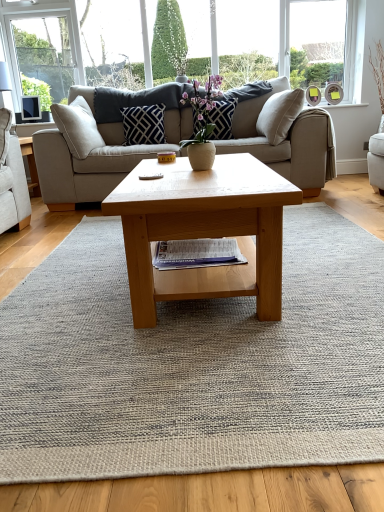
Question: From the image's perspective, is light brown wooden coffee table at center under neutral woven rug at center?

Choices:
 (A) no
 (B) yes

Answer: (A)

Question: Is neutral woven rug at center located within light brown wooden coffee table at center?

Choices:
 (A) yes
 (B) no

Answer: (B)

Question: Is light brown wooden coffee table at center completely or partially outside of neutral woven rug at center?

Choices:
 (A) no
 (B) yes

Answer: (B)

Question: Does light brown wooden coffee table at center have a greater height compared to neutral woven rug at center?

Choices:
 (A) yes
 (B) no

Answer: (A)

Question: From a real-world perspective, does light brown wooden coffee table at center stand above neutral woven rug at center?

Choices:
 (A) no
 (B) yes

Answer: (B)

Question: From the image's perspective, is white textured bay window at upper right located above or below beige fabric couch at center?

Choices:
 (A) below
 (B) above

Answer: (B)

Question: In terms of size, does white textured bay window at upper right appear bigger or smaller than beige fabric couch at center?

Choices:
 (A) big
 (B) small

Answer: (B)

Question: Relative to beige fabric couch at center, is white textured bay window at upper right in front or behind?

Choices:
 (A) front
 (B) behind

Answer: (B)

Question: From a real-world perspective, relative to beige fabric couch at center, is white textured bay window at upper right vertically above or below?

Choices:
 (A) below
 (B) above

Answer: (B)

Question: Is neutral woven rug at center wider or thinner than matte black pillow at center, which ranks as the 1th pillow in right-to-left order?

Choices:
 (A) thin
 (B) wide

Answer: (B)

Question: Considering their positions, is neutral woven rug at center located in front of or behind matte black pillow at center, which ranks as the 1th pillow in right-to-left order?

Choices:
 (A) behind
 (B) front

Answer: (B)

Question: From a real-world perspective, is neutral woven rug at center above or below matte black pillow at center, arranged as the 2th pillow when viewed from the left?

Choices:
 (A) below
 (B) above

Answer: (A)

Question: Is neutral woven rug at center inside the boundaries of matte black pillow at center, arranged as the 2th pillow when viewed from the left, or outside?

Choices:
 (A) inside
 (B) outside

Answer: (B)

Question: Is light brown wooden coffee table at center inside or outside of beige fabric couch at center?

Choices:
 (A) inside
 (B) outside

Answer: (B)

Question: Would you say light brown wooden coffee table at center is to the left or to the right of beige fabric couch at center in the picture?

Choices:
 (A) right
 (B) left

Answer: (A)